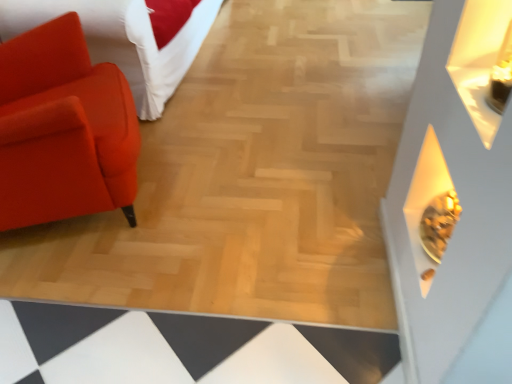
Question: From a real-world perspective, does matte orange chair at left sit lower than matte orange sofa at left?

Choices:
 (A) no
 (B) yes

Answer: (A)

Question: Is matte orange chair at left looking in the opposite direction of matte orange sofa at left?

Choices:
 (A) yes
 (B) no

Answer: (B)

Question: Can matte orange sofa at left be found inside matte orange chair at left?

Choices:
 (A) no
 (B) yes

Answer: (A)

Question: Does matte orange chair at left have a greater width compared to matte orange sofa at left?

Choices:
 (A) no
 (B) yes

Answer: (A)

Question: From the image's perspective, is matte orange chair at left above matte orange sofa at left?

Choices:
 (A) no
 (B) yes

Answer: (A)

Question: Can you confirm if matte orange chair at left is smaller than matte orange sofa at left?

Choices:
 (A) yes
 (B) no

Answer: (A)

Question: From a real-world perspective, is matte orange sofa at left located beneath matte orange chair at left?

Choices:
 (A) yes
 (B) no

Answer: (A)

Question: Can you confirm if matte orange sofa at left is thinner than matte orange chair at left?

Choices:
 (A) yes
 (B) no

Answer: (B)

Question: From a real-world perspective, is matte orange sofa at left on top of matte orange chair at left?

Choices:
 (A) no
 (B) yes

Answer: (A)

Question: Considering the relative sizes of matte orange sofa at left and matte orange chair at left in the image provided, is matte orange sofa at left taller than matte orange chair at left?

Choices:
 (A) yes
 (B) no

Answer: (B)

Question: Is matte orange sofa at left wider than matte orange chair at left?

Choices:
 (A) no
 (B) yes

Answer: (B)

Question: From the image's perspective, would you say matte orange sofa at left is shown under matte orange chair at left?

Choices:
 (A) no
 (B) yes

Answer: (A)

Question: From the image's perspective, is matte orange sofa at left above or below matte orange chair at left?

Choices:
 (A) above
 (B) below

Answer: (A)